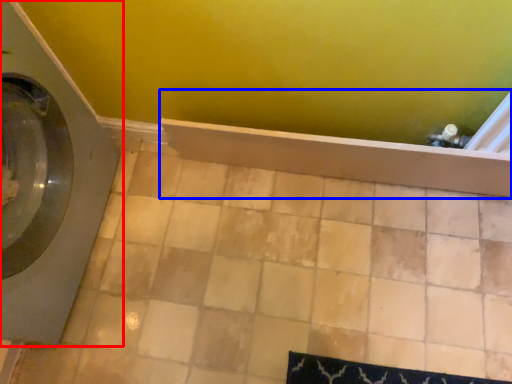
Question: Which point is further to the camera, washing machine (highlighted by a red box) or bath (highlighted by a blue box)?

Choices:
 (A) washing machine
 (B) bath

Answer: (B)